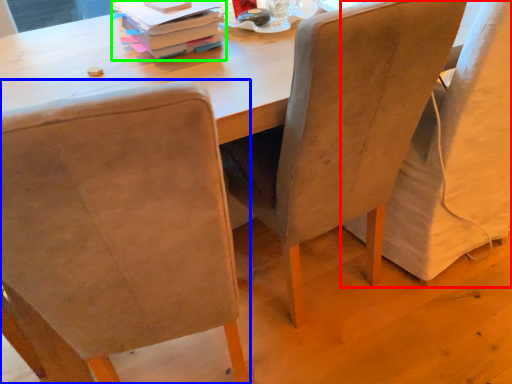
Question: Estimate the real-world distances between objects in this image. Which object is closer to chair (highlighted by a red box), chair (highlighted by a blue box) or book (highlighted by a green box)?

Choices:
 (A) chair
 (B) book

Answer: (B)